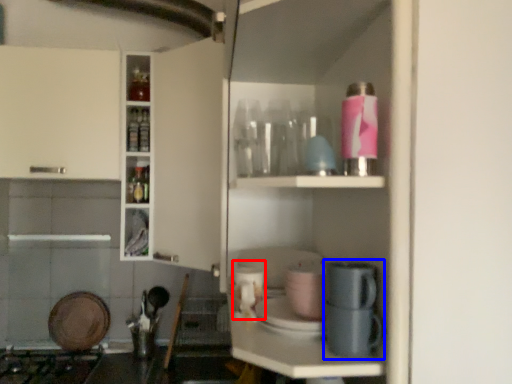
Question: Which object is further to the camera taking this photo, appliance (highlighted by a red box) or coffee machine (highlighted by a blue box)?

Choices:
 (A) appliance
 (B) coffee machine

Answer: (A)